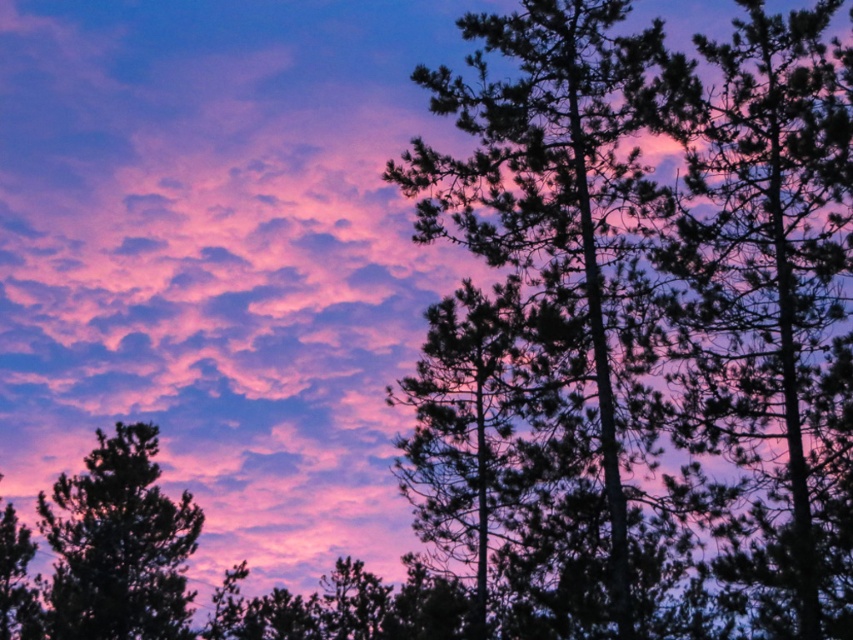
Question: Which point is farther to the camera?

Choices:
 (A) silhouette tree at center
 (B) green matte tree at lower left

Answer: (B)

Question: Is black textured tree at center further to the viewer compared to silhouette tree at center?

Choices:
 (A) yes
 (B) no

Answer: (B)

Question: Which point is farther from the camera taking this photo?

Choices:
 (A) (570, 36)
 (B) (165, 580)

Answer: (B)

Question: Can you confirm if silhouette tree at center is positioned to the left of green matte tree at lower left?

Choices:
 (A) yes
 (B) no

Answer: (B)

Question: Among these objects, which one is nearest to the camera?

Choices:
 (A) green matte tree at lower left
 (B) silhouette tree at center

Answer: (B)

Question: Is silhouette tree at center smaller than green matte tree at lower left?

Choices:
 (A) no
 (B) yes

Answer: (B)